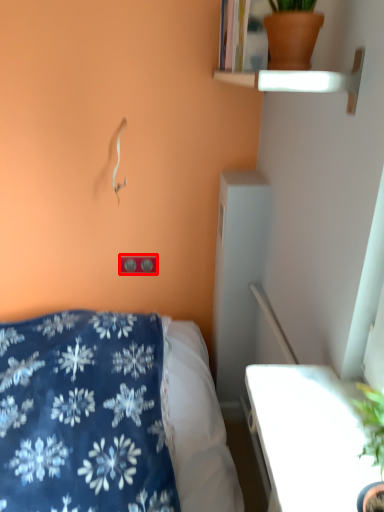
Question: In this image, where is electric outlet (annotated by the red box) located relative to flowerpot?

Choices:
 (A) left
 (B) right

Answer: (A)